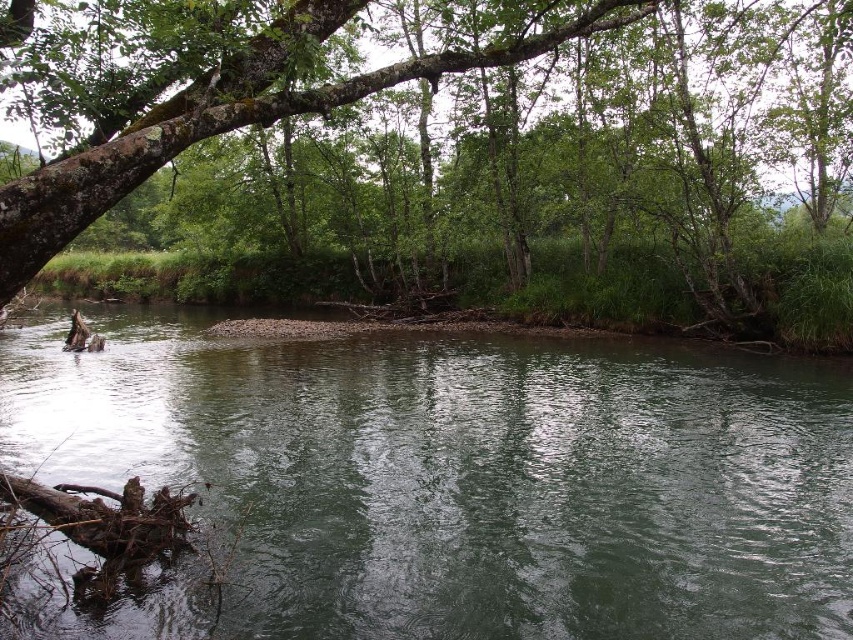
Question: Which object is farther from the camera taking this photo?

Choices:
 (A) green rough bark tree at upper left
 (B) green smooth water at center

Answer: (B)

Question: Does green rough bark tree at upper left have a larger size compared to green smooth water at center?

Choices:
 (A) yes
 (B) no

Answer: (A)

Question: Is the position of green rough bark tree at upper left less distant than that of green smooth water at center?

Choices:
 (A) yes
 (B) no

Answer: (A)

Question: Is green rough bark tree at upper left positioned in front of green smooth water at center?

Choices:
 (A) no
 (B) yes

Answer: (B)

Question: Among these objects, which one is nearest to the camera?

Choices:
 (A) green smooth water at center
 (B) green rough bark tree at upper left

Answer: (B)

Question: Which of the following is the farthest from the observer?

Choices:
 (A) pyautogui.click(x=670, y=150)
 (B) pyautogui.click(x=403, y=534)

Answer: (A)